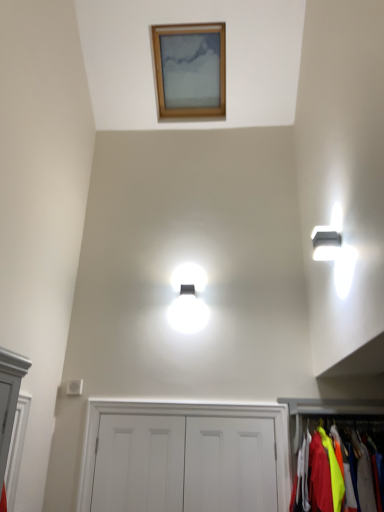
Question: Based on their positions, is white matte door at center, which appears as the 2th door when viewed from the right, located to the left or right of neon yellow fabric at lower right, positioned as the second dresser in left-to-right order?

Choices:
 (A) right
 (B) left

Answer: (B)

Question: Do you think white matte door at center, placed as the first door when sorted from left to right, is within neon yellow fabric at lower right, the first dresser from the right, or outside of it?

Choices:
 (A) inside
 (B) outside

Answer: (B)

Question: Which object is positioned closest to the white matte door at center, which appears as the 2th door when viewed from the right?

Choices:
 (A) neon yellow fabric at lower right, the first dresser from the right
 (B) white matte door at center, positioned as the first dresser in left-to-right order
 (C) white matte door at center, positioned as the second door in left-to-right order
 (D) wooden picture frame at upper center

Answer: (B)

Question: Which object is positioned farthest from the neon yellow fabric at lower right, positioned as the second dresser in left-to-right order?

Choices:
 (A) white matte door at center, marked as the second dresser in a right-to-left arrangement
 (B) white matte door at center, which appears as the 2th door when viewed from the right
 (C) white matte door at center, positioned as the second door in left-to-right order
 (D) wooden picture frame at upper center

Answer: (D)